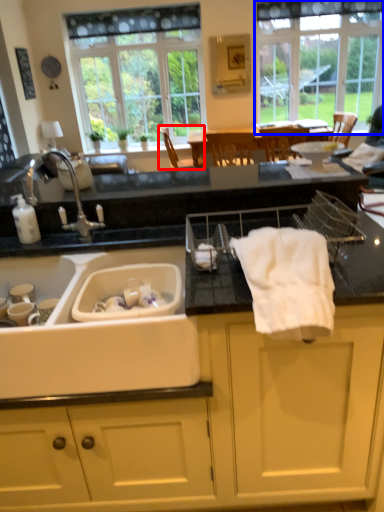
Question: Which point is further to the camera, chair (highlighted by a red box) or window (highlighted by a blue box)?

Choices:
 (A) chair
 (B) window

Answer: (B)